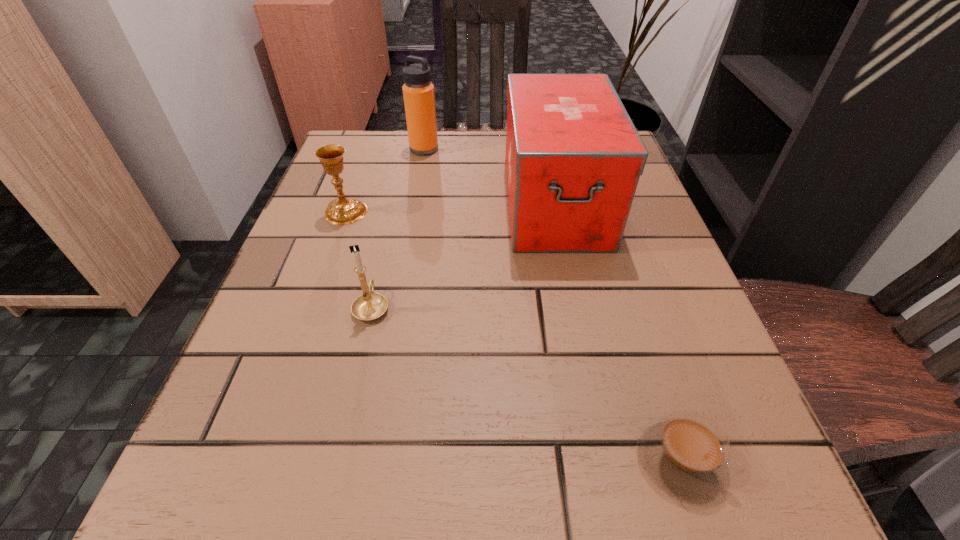
The height and width of the screenshot is (540, 960). I want to click on vacant space located on the handle side of the candle holder, so click(389, 233).

Where is `blank space located 0.080m on the back of the leftmost object`? Image resolution: width=960 pixels, height=540 pixels. blank space located 0.080m on the back of the leftmost object is located at coordinates (358, 178).

Image resolution: width=960 pixels, height=540 pixels. What are the coordinates of `blank space located 0.200m on the back of the cappuccino` in the screenshot? It's located at (630, 303).

What are the coordinates of `thermos bottle situated at the far edge` in the screenshot? It's located at (418, 92).

I want to click on the first-aid kit that is at the far edge, so click(573, 159).

The width and height of the screenshot is (960, 540). I want to click on object present at the near edge, so click(x=685, y=454).

This screenshot has height=540, width=960. I want to click on candle holder that is at the left edge, so click(x=369, y=306).

I want to click on chalice situated at the left edge, so click(341, 211).

Identify the location of the first-aid kit that is positioned at the right edge. The width and height of the screenshot is (960, 540). (573, 159).

The width and height of the screenshot is (960, 540). I want to click on cappuccino that is positioned at the right edge, so (x=685, y=454).